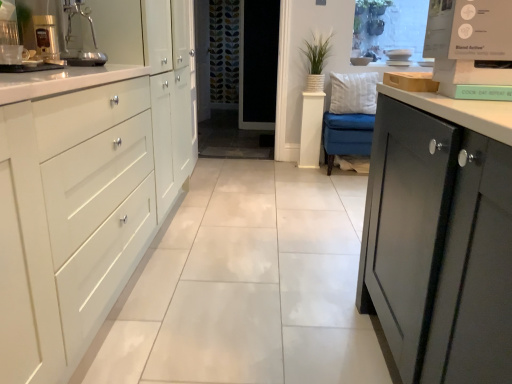
The height and width of the screenshot is (384, 512). Describe the element at coordinates (353, 93) in the screenshot. I see `white plush pillow at center` at that location.

Describe the element at coordinates (88, 181) in the screenshot. I see `white glossy cabinet at left` at that location.

Where is `green woven basket at center`? The width and height of the screenshot is (512, 384). green woven basket at center is located at coordinates coord(317,53).

You are a GUI agent. You are given a task and a screenshot of the screen. Output one action in this format:
    pyautogui.click(x=<x>, y=<y>)
    Task: Click on the metallic silver coffee machine at upper left
    This screenshot has width=512, height=384.
    Given the screenshot: What is the action you would take?
    pyautogui.click(x=46, y=38)

Could you measure the distance between metallic silver coffee machine at upper left and transparent glass screen door at center?

12.98 feet.

Is metallic silver coffee machine at upper left positioned with its back to transparent glass screen door at center?

metallic silver coffee machine at upper left does not have its back to transparent glass screen door at center.

In the image, is metallic silver coffee machine at upper left on the left side or the right side of transparent glass screen door at center?

Clearly, metallic silver coffee machine at upper left is on the left of transparent glass screen door at center in the image.

Considering the positions of objects metallic silver coffee machine at upper left and transparent glass screen door at center in the image provided, who is behind, metallic silver coffee machine at upper left or transparent glass screen door at center?

transparent glass screen door at center.

Which is more to the right, white glossy cabinet at left or green woven basket at center?

From the viewer's perspective, green woven basket at center appears more on the right side.

Which is further, (x=174, y=100) or (x=323, y=41)?

The point (x=323, y=41) is more distant.

From a real-world perspective, is white glossy cabinet at left physically above green woven basket at center?

No, from a real-world perspective, white glossy cabinet at left is not over green woven basket at center

Who is bigger, white glossy cabinet at left or green woven basket at center?

white glossy cabinet at left.

From the picture: Between green woven basket at center and white glossy cabinet at left, which one has larger width?

Wider between the two is white glossy cabinet at left.

Considering the sizes of objects green woven basket at center and white glossy cabinet at left in the image provided, who is taller, green woven basket at center or white glossy cabinet at left?

With more height is white glossy cabinet at left.

Where is `plant above the white glossy cabinet at left (from a real-world perspective)`? plant above the white glossy cabinet at left (from a real-world perspective) is located at coordinates (317, 53).

Does green woven basket at center have a larger size compared to white glossy cabinet at left?

No, green woven basket at center is not bigger than white glossy cabinet at left.

Considering the sizes of objects white plush pillow at center and transparent glass screen door at center in the image provided, who is smaller, white plush pillow at center or transparent glass screen door at center?

With smaller size is white plush pillow at center.

From the image's perspective, between white plush pillow at center and transparent glass screen door at center, who is located below?

From the image's view, white plush pillow at center is below.

Considering the relative sizes of white plush pillow at center and transparent glass screen door at center in the image provided, is white plush pillow at center taller than transparent glass screen door at center?

In fact, white plush pillow at center may be shorter than transparent glass screen door at center.

Measure the distance between white plush pillow at center and transparent glass screen door at center.

A distance of 2.03 meters exists between white plush pillow at center and transparent glass screen door at center.

Is white glossy cabinet at left with white plush pillow at center?

No, white glossy cabinet at left is not making contact with white plush pillow at center.

Is white glossy cabinet at left positioned behind white plush pillow at center?

No.

In the scene shown: Considering the relative sizes of white plush pillow at center and green woven basket at center in the image provided, is white plush pillow at center bigger than green woven basket at center?

No, white plush pillow at center is not bigger than green woven basket at center.

Is white plush pillow at center to the left of green woven basket at center from the viewer's perspective?

In fact, white plush pillow at center is to the right of green woven basket at center.

Considering the sizes of objects white plush pillow at center and green woven basket at center in the image provided, who is shorter, white plush pillow at center or green woven basket at center?

With less height is white plush pillow at center.

Is metallic silver coffee machine at upper left not close to green woven basket at center?

Yes, metallic silver coffee machine at upper left and green woven basket at center are quite far apart.

Is metallic silver coffee machine at upper left further to the viewer compared to green woven basket at center?

No, the depth of metallic silver coffee machine at upper left is less than that of green woven basket at center.

Can you confirm if metallic silver coffee machine at upper left is taller than green woven basket at center?

Incorrect, the height of metallic silver coffee machine at upper left is not larger of that of green woven basket at center.

Considering the sizes of objects metallic silver coffee machine at upper left and green woven basket at center in the image provided, who is wider, metallic silver coffee machine at upper left or green woven basket at center?

With larger width is green woven basket at center.

This screenshot has width=512, height=384. I want to click on coffee machine above the transparent glass screen door at center (from a real-world perspective), so click(x=46, y=38).

Find the location of `cabinetry below the green woven basket at center (from the image's perspective)`. cabinetry below the green woven basket at center (from the image's perspective) is located at coordinates (88, 181).

Looking at the image, which one is located closer to green woven basket at center, transparent glass screen door at center or white glossy cabinet at left?

transparent glass screen door at center is positioned closer to the anchor green woven basket at center.

Which object lies nearer to the anchor point white glossy cabinet at left, white plush pillow at center or metallic silver coffee machine at upper left?

metallic silver coffee machine at upper left is positioned closer to the anchor white glossy cabinet at left.

Considering their positions, is white plush pillow at center positioned closer to metallic silver coffee machine at upper left than white glossy cabinet at left?

Based on the image, white glossy cabinet at left appears to be nearer to metallic silver coffee machine at upper left.

Estimate the real-world distances between objects in this image. Which object is further from white glossy cabinet at left, transparent glass screen door at center or green woven basket at center?

transparent glass screen door at center.

Estimate the real-world distances between objects in this image. Which object is closer to white plush pillow at center, white glossy cabinet at left or metallic silver coffee machine at upper left?

The object closer to white plush pillow at center is white glossy cabinet at left.

Looking at this image, which object lies further to the anchor point white glossy cabinet at left, green woven basket at center or white plush pillow at center?

The object further to white glossy cabinet at left is green woven basket at center.

Looking at the image, which one is located closer to green woven basket at center, white plush pillow at center or white glossy cabinet at left?

Based on the image, white plush pillow at center appears to be nearer to green woven basket at center.

From the image, which object appears to be farther from transparent glass screen door at center, metallic silver coffee machine at upper left or white plush pillow at center?

The object further to transparent glass screen door at center is metallic silver coffee machine at upper left.

Locate an element on the screen. This screenshot has width=512, height=384. plant located between white glossy cabinet at left and transparent glass screen door at center in the depth direction is located at coordinates (317, 53).

Image resolution: width=512 pixels, height=384 pixels. Identify the location of plant situated between transparent glass screen door at center and white plush pillow at center from left to right. (317, 53).

Locate an element on the screen. Image resolution: width=512 pixels, height=384 pixels. pillow located between white glossy cabinet at left and transparent glass screen door at center in the depth direction is located at coordinates (353, 93).

You are a GUI agent. You are given a task and a screenshot of the screen. Output one action in this format:
    pyautogui.click(x=<x>, y=<y>)
    Task: Click on the plant positioned between metallic silver coffee machine at upper left and transparent glass screen door at center from near to far
    
    Given the screenshot: What is the action you would take?
    pyautogui.click(x=317, y=53)